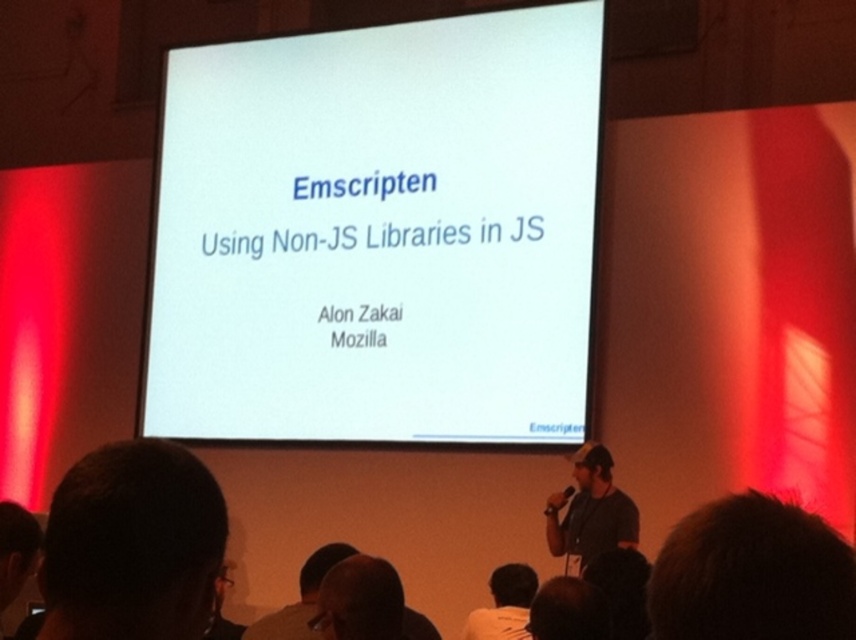
Which of these two, dark hair at lower left or brown hair at lower right, stands shorter?

brown hair at lower right

Where is `dark hair at lower left`? The height and width of the screenshot is (640, 856). dark hair at lower left is located at coordinates (132, 545).

Does dark hair at lower left lie behind brown hair at lower left?

No, dark hair at lower left is in front of brown hair at lower left.

Based on the photo, does dark hair at lower left have a larger size compared to brown hair at lower left?

Indeed, dark hair at lower left has a larger size compared to brown hair at lower left.

Between point (107, 454) and point (3, 580), which one is positioned behind?

Point (3, 580)

At what (x,y) coordinates should I click in order to perform the action: click on dark hair at lower left. Please return your answer as a coordinate pair (x, y). Looking at the image, I should click on click(132, 545).

Between gray fabric shirt at lower right and bald head at lower center, which one is positioned lower?

bald head at lower center

Between point (584, 529) and point (322, 579), which one is positioned in front?

Point (322, 579)

The image size is (856, 640). Describe the element at coordinates (589, 512) in the screenshot. I see `gray fabric shirt at lower right` at that location.

What are the coordinates of `gray fabric shirt at lower right` in the screenshot? It's located at (589, 512).